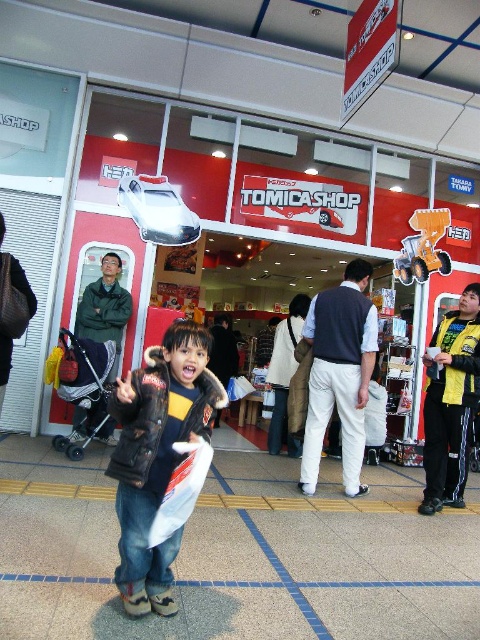
Can you confirm if dark brown leather jacket at center is positioned below white cotton pants at center?

Indeed, dark brown leather jacket at center is positioned under white cotton pants at center.

Describe the element at coordinates (156, 456) in the screenshot. The width and height of the screenshot is (480, 640). I see `dark brown leather jacket at center` at that location.

The height and width of the screenshot is (640, 480). What are the coordinates of `dark brown leather jacket at center` in the screenshot? It's located at [156, 456].

Is dark brown leather jacket at center shorter than yellow plastic construction vehicle at center?

Incorrect, dark brown leather jacket at center's height does not fall short of yellow plastic construction vehicle at center's.

Is dark brown leather jacket at center taller than yellow plastic construction vehicle at center?

Yes, dark brown leather jacket at center is taller than yellow plastic construction vehicle at center.

Describe the element at coordinates (156, 456) in the screenshot. The height and width of the screenshot is (640, 480). I see `dark brown leather jacket at center` at that location.

The height and width of the screenshot is (640, 480). Find the location of `dark brown leather jacket at center`. dark brown leather jacket at center is located at coordinates (156, 456).

Is white cotton pants at center below yellow plastic construction vehicle at center?

Yes.

Who is more forward, (314, 314) or (442, 216)?

Point (314, 314) is in front.

Identify the location of white cotton pants at center. (339, 372).